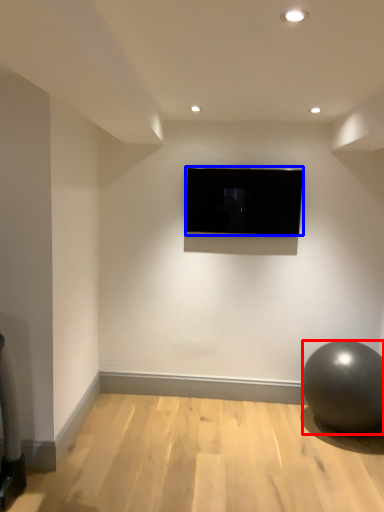
Question: Which of the following is the farthest to the observer, ball (highlighted by a red box) or television (highlighted by a blue box)?

Choices:
 (A) ball
 (B) television

Answer: (B)